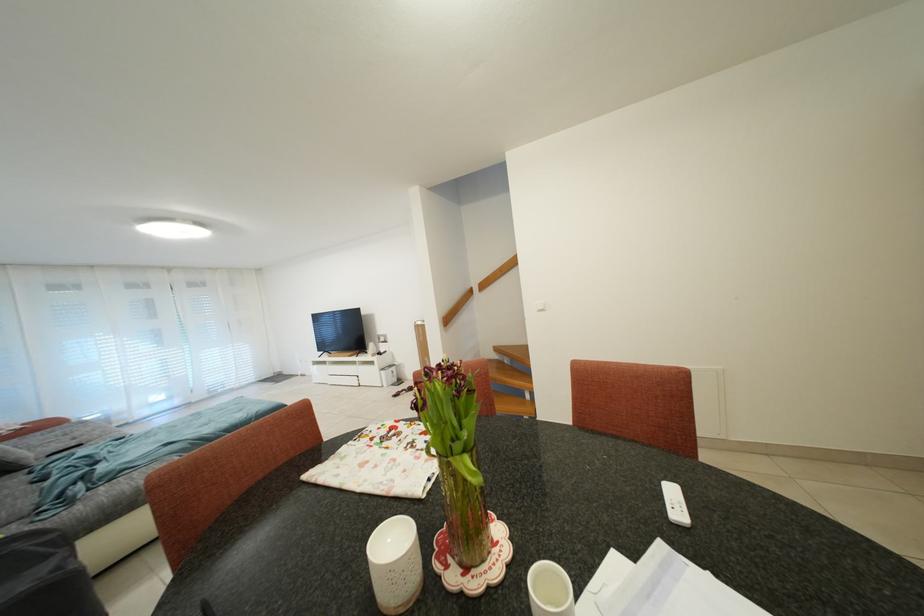
Describe the element at coordinates (342, 379) in the screenshot. This screenshot has height=616, width=924. I see `the drawer handle` at that location.